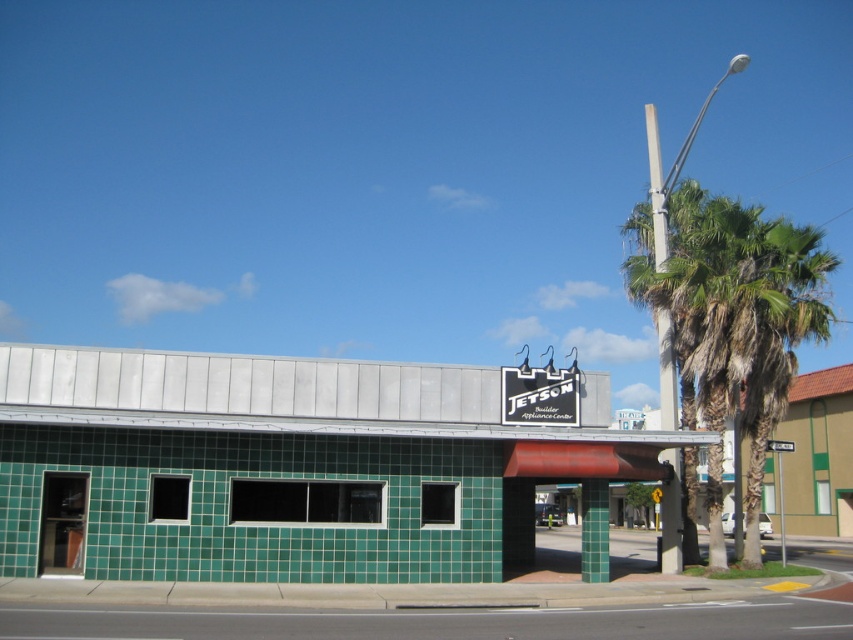
You are standing in front of the building and want to locate the entrance. You see the green leafy palm tree at upper right and the black plastic sign at center. Which object is closer to the entrance?

The black plastic sign at center is closer to the entrance because the green leafy palm tree at upper right is positioned on the right side of it, meaning the palm tree is further away from the entrance compared to the sign.

You are standing in front of the commercial building and want to take a photo of the entrance. To include the green leafy palm tree at upper right in the frame, where should you position yourself relative to the building?

Position yourself to the left side of the building so that the green leafy palm tree at upper right at point [733,307] is within your camera frame.